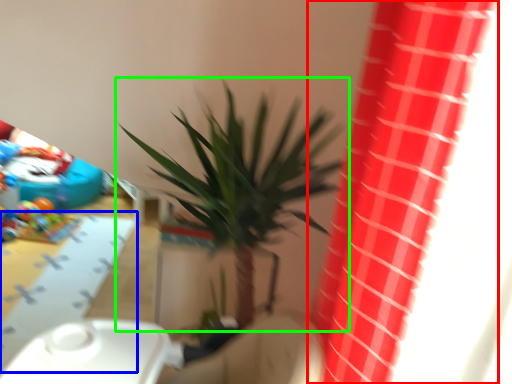
Question: Which is nearer to the curtain (highlighted by a red box)? table (highlighted by a blue box) or houseplant (highlighted by a green box).

Choices:
 (A) table
 (B) houseplant

Answer: (B)